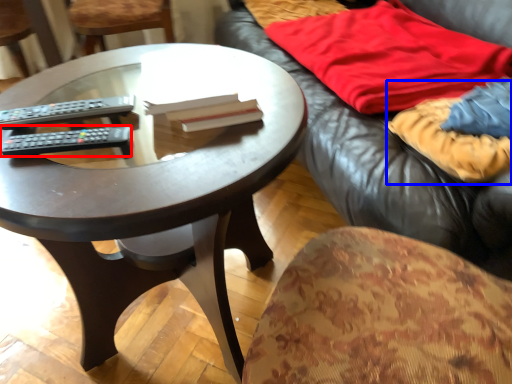
Question: Which point is closer to the camera, remote control (highlighted by a red box) or blanket (highlighted by a blue box)?

Choices:
 (A) remote control
 (B) blanket

Answer: (A)